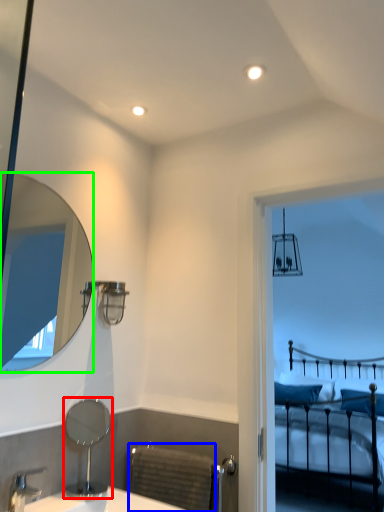
Question: Estimate the real-world distances between objects in this image. Which object is farther from mirror (highlighted by a red box), radiator (highlighted by a blue box) or mirror (highlighted by a green box)?

Choices:
 (A) radiator
 (B) mirror

Answer: (B)